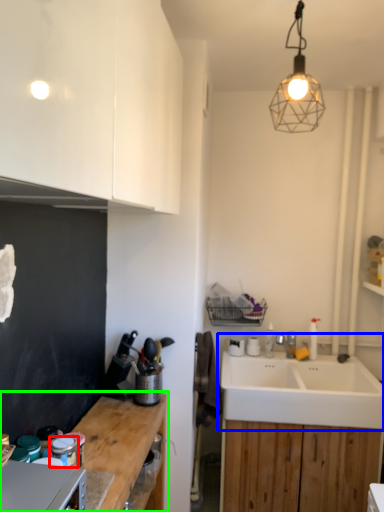
Question: Which is nearer to the appliance (highlighted by a red box)? sink (highlighted by a blue box) or countertop (highlighted by a green box).

Choices:
 (A) sink
 (B) countertop

Answer: (B)